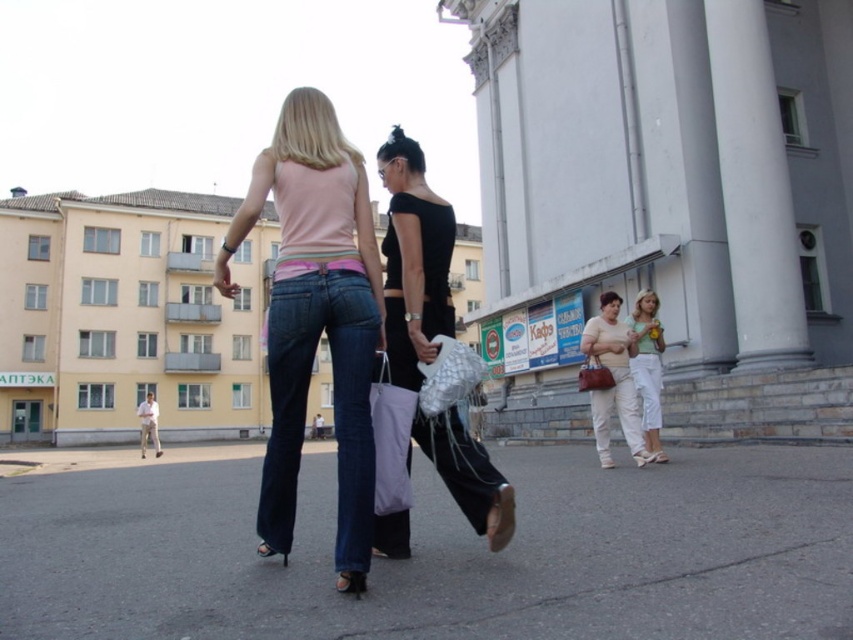
Is gray asphalt at center below denim jeans at center?

Indeed, gray asphalt at center is positioned under denim jeans at center.

Can you confirm if gray asphalt at center is positioned to the left of denim jeans at center?

No, gray asphalt at center is not to the left of denim jeans at center.

Is point (693, 605) positioned before point (289, 145)?

Yes.

You are a GUI agent. You are given a task and a screenshot of the screen. Output one action in this format:
    pyautogui.click(x=<x>, y=<y>)
    Task: Click on the gray asphalt at center
    The height and width of the screenshot is (640, 853).
    Given the screenshot: What is the action you would take?
    pyautogui.click(x=442, y=554)

Identify the location of gray asphalt at center. (442, 554).

Who is more distant from viewer, (525, 570) or (643, 410)?

The point (643, 410) is more distant.

Where is `gray asphalt at center`? The height and width of the screenshot is (640, 853). gray asphalt at center is located at coordinates [442, 554].

Between denim at center and white cotton pants at lower right, which one has less height?

With less height is white cotton pants at lower right.

Who is higher up, denim at center or white cotton pants at lower right?

Positioned higher is white cotton pants at lower right.

Does point (318, 337) come closer to viewer compared to point (650, 406)?

That is True.

The image size is (853, 640). Identify the location of denim at center. (332, 403).